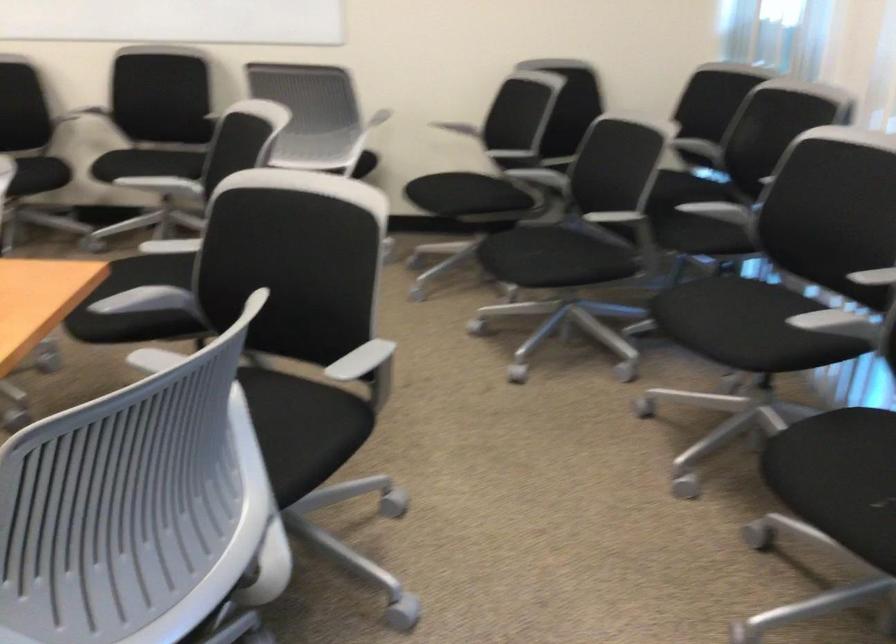
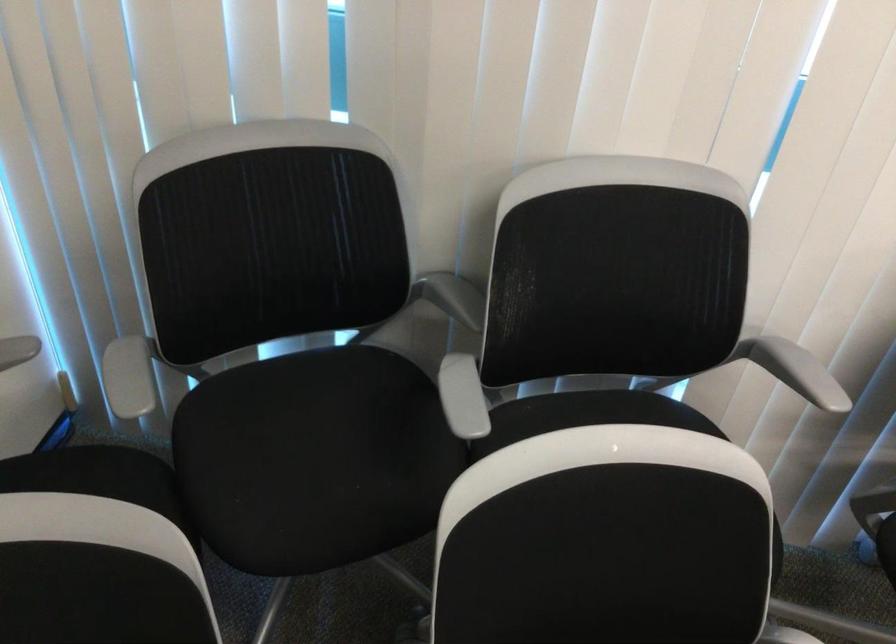
In the second image, find the point that corresponds to [755,133] in the first image.

(453, 297)